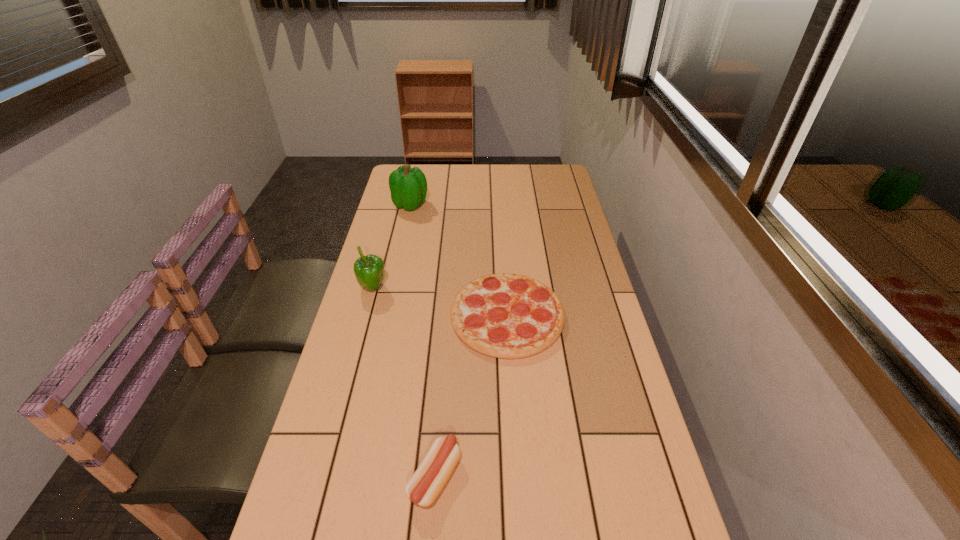
The width and height of the screenshot is (960, 540). In the image, there is a desktop. Find the location of `vacant space at the far edge`. vacant space at the far edge is located at coordinates (486, 189).

Locate an element on the screen. The width and height of the screenshot is (960, 540). free space at the left edge is located at coordinates (390, 389).

Image resolution: width=960 pixels, height=540 pixels. In the image, there is a desktop. Find the location of `vacant space at the right edge`. vacant space at the right edge is located at coordinates (592, 282).

At what (x,y) coordinates should I click in order to perform the action: click on vacant region at the far left corner of the desktop. Please return your answer as a coordinate pair (x, y). Looking at the image, I should click on (428, 170).

Where is `free space between the farther bell pepper and the nearer bell pepper`? The height and width of the screenshot is (540, 960). free space between the farther bell pepper and the nearer bell pepper is located at coordinates (392, 246).

Image resolution: width=960 pixels, height=540 pixels. I want to click on empty space between the pizza and the farther bell pepper, so click(459, 260).

You are a GUI agent. You are given a task and a screenshot of the screen. Output one action in this format:
    pyautogui.click(x=<x>, y=<y>)
    Task: Click on the vacant area that lies between the shortest object and the farthest object
    The width and height of the screenshot is (960, 540).
    Given the screenshot: What is the action you would take?
    pyautogui.click(x=459, y=260)

I want to click on free space between the second shortest object and the nearer bell pepper, so click(x=404, y=382).

I want to click on empty space that is in between the nearer bell pepper and the farther bell pepper, so click(392, 246).

This screenshot has height=540, width=960. I want to click on empty space between the farther bell pepper and the pizza, so click(x=459, y=260).